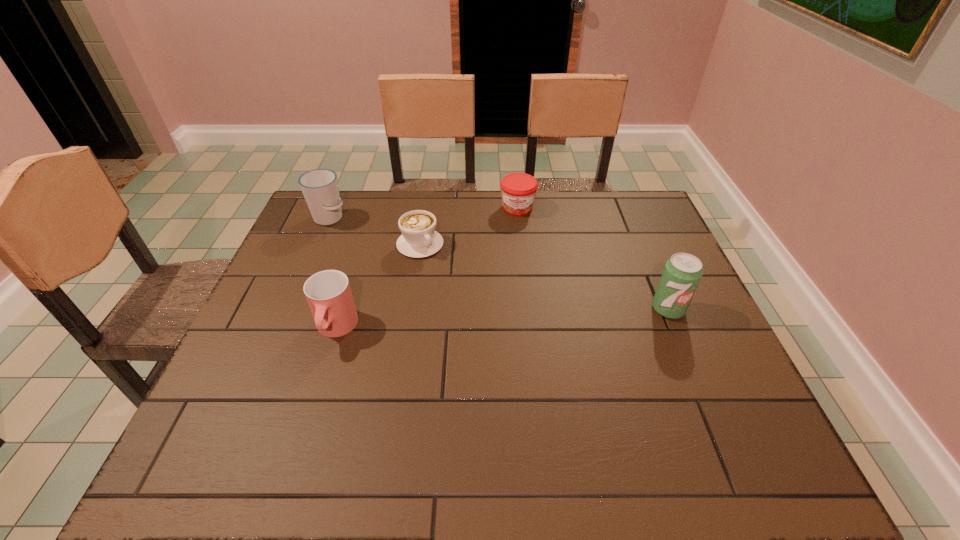
Where is `free space located to the right of the third nearest object's handle`? The width and height of the screenshot is (960, 540). free space located to the right of the third nearest object's handle is located at coordinates (516, 346).

Locate an element on the screen. vacant space situated 0.200m to the right of the third nearest object's handle is located at coordinates (470, 298).

This screenshot has width=960, height=540. I want to click on vacant region located 0.210m to the right of the third nearest object's handle, so click(473, 300).

Image resolution: width=960 pixels, height=540 pixels. I want to click on free space located on the label side of the jam, so click(x=516, y=284).

Locate an element on the screen. free point located on the label side of the jam is located at coordinates (516, 286).

Locate an element on the screen. This screenshot has width=960, height=540. free space located 0.050m on the label side of the jam is located at coordinates (517, 228).

Identify the location of vacant space located 0.280m with a handle on the side of the left cup. This screenshot has height=540, width=960. (396, 268).

What are the coordinates of `free location located 0.320m with a handle on the side of the left cup` in the screenshot? It's located at (405, 275).

Locate an element on the screen. The width and height of the screenshot is (960, 540). vacant space located 0.210m with a handle on the side of the left cup is located at coordinates (381, 256).

You are a GUI agent. You are given a task and a screenshot of the screen. Output one action in this format:
    pyautogui.click(x=<x>, y=<y>)
    Task: Click on the cappuccino that is at the far edge
    Image resolution: width=960 pixels, height=540 pixels.
    Given the screenshot: What is the action you would take?
    pyautogui.click(x=419, y=239)